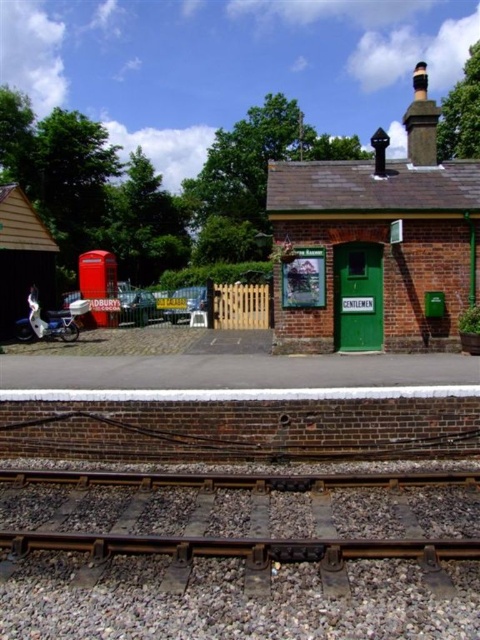
Can you confirm if dark brown metal train track at bottom is bigger than green painted brick building at upper right?

Actually, dark brown metal train track at bottom might be smaller than green painted brick building at upper right.

Can you confirm if dark brown metal train track at bottom is positioned below green painted brick building at upper right?

Indeed, dark brown metal train track at bottom is positioned under green painted brick building at upper right.

Is point (348, 518) closer to viewer compared to point (470, 189)?

Yes, point (348, 518) is closer to viewer.

This screenshot has height=640, width=480. Identify the location of dark brown metal train track at bottom. (239, 528).